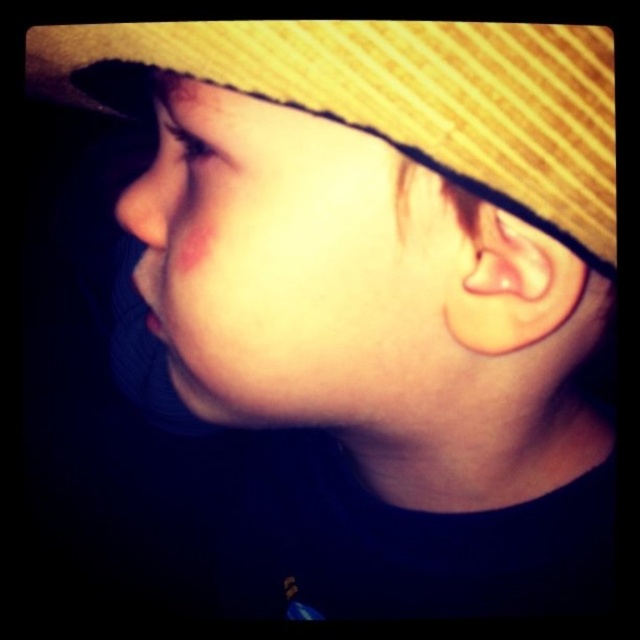
Question: Which object appears closest to the camera in this image?

Choices:
 (A) pink skin at center
 (B) yellow woven hat at upper center
 (C) matte skin nose at left

Answer: (B)

Question: Where is pink skin at center located in relation to matte skin nose at left in the image?

Choices:
 (A) above
 (B) below

Answer: (B)

Question: Is pink skin at center bigger than yellow woven hat at upper center?

Choices:
 (A) no
 (B) yes

Answer: (A)

Question: Estimate the real-world distances between objects in this image. Which object is farther from the yellow woven hat at upper center?

Choices:
 (A) matte skin nose at left
 (B) pink skin at center

Answer: (A)

Question: Estimate the real-world distances between objects in this image. Which object is farther from the matte skin nose at left?

Choices:
 (A) yellow woven hat at upper center
 (B) pink skin at center

Answer: (A)

Question: Does yellow woven hat at upper center have a smaller size compared to matte skin nose at left?

Choices:
 (A) no
 (B) yes

Answer: (A)